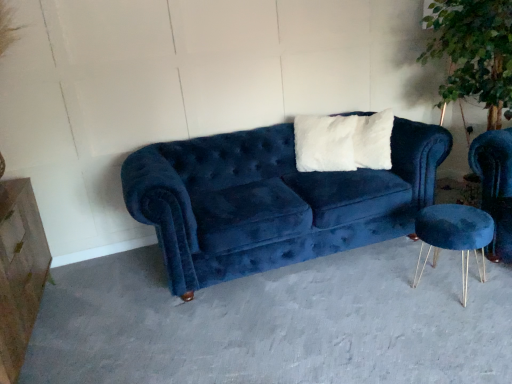
The image size is (512, 384). I want to click on unoccupied area behind velvet blue stool at lower right, so click(407, 251).